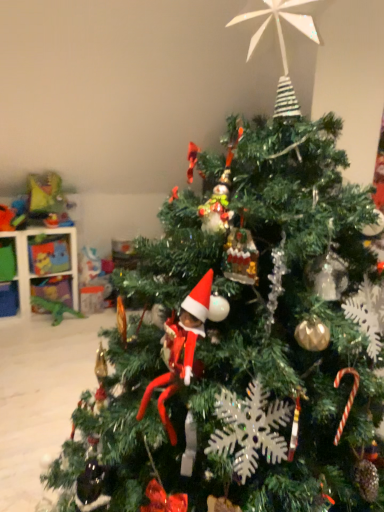
Question: Considering the relative positions of plastic dinosaur at upper left, the first toy viewed from the top, and white plastic shelf at left in the image provided, is plastic dinosaur at upper left, the first toy viewed from the top, to the left or to the right of white plastic shelf at left?

Choices:
 (A) left
 (B) right

Answer: (B)

Question: Is plastic dinosaur at upper left, the first toy viewed from the top, in front of or behind white plastic shelf at left in the image?

Choices:
 (A) front
 (B) behind

Answer: (B)

Question: Estimate the real-world distances between objects in this image. Which object is closer to the white plastic shelf at left?

Choices:
 (A) plastic dinosaur at upper left, which ranks as the second toy in bottom-to-top order
 (B) green plastic dinosaur at lower left, marked as the first toy in a bottom-to-top arrangement

Answer: (A)

Question: Considering the real-world distances, which object is closest to the white plastic shelf at left?

Choices:
 (A) plastic dinosaur at upper left, which ranks as the second toy in bottom-to-top order
 (B) green plastic dinosaur at lower left, marked as the first toy in a bottom-to-top arrangement

Answer: (A)